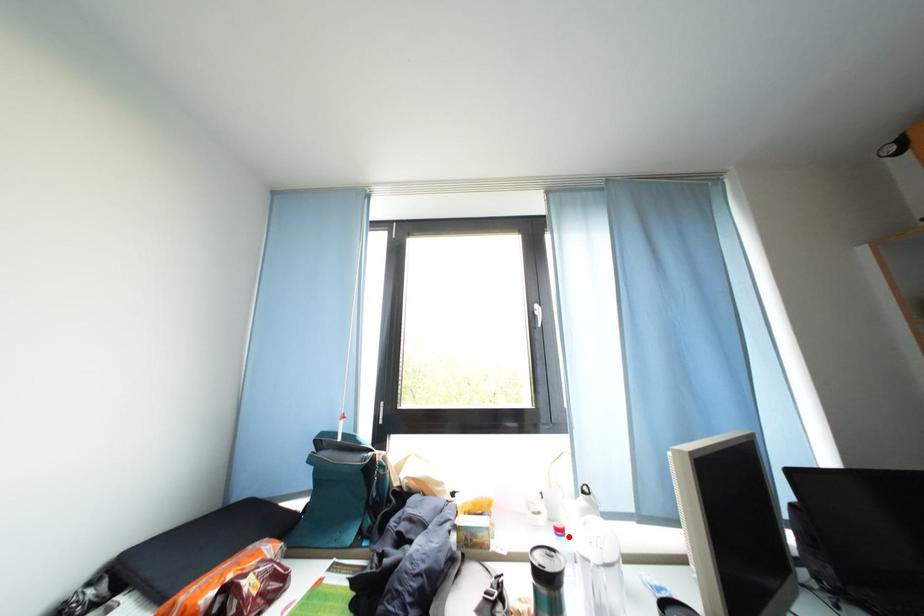
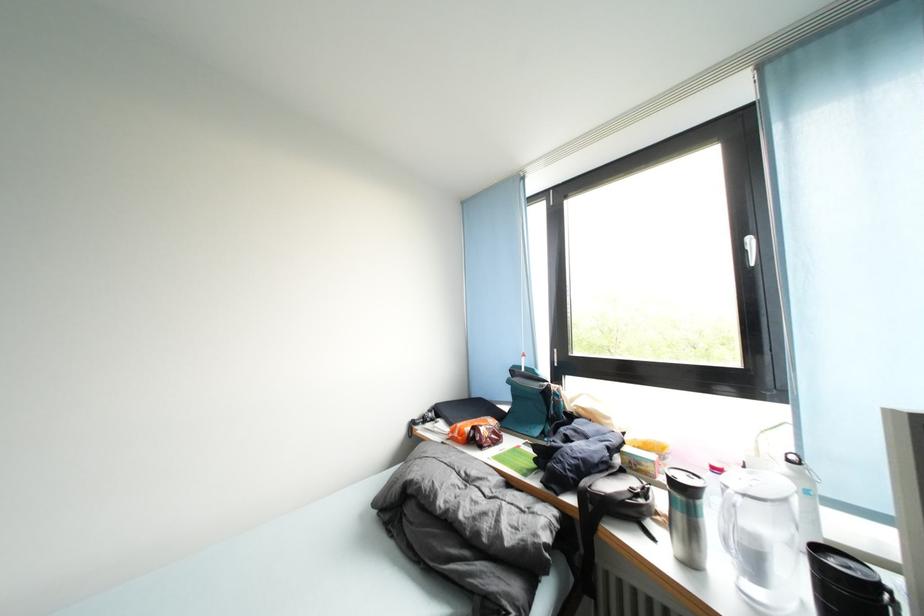
Locate, in the second image, the point that corresponds to the highlighted location in the first image.

(723, 475)